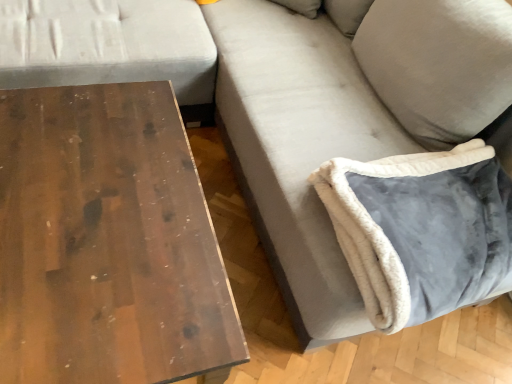
Where is `wooden table at left`? This screenshot has height=384, width=512. wooden table at left is located at coordinates (106, 242).

The height and width of the screenshot is (384, 512). Describe the element at coordinates (106, 242) in the screenshot. I see `wooden table at left` at that location.

Describe the element at coordinates (422, 230) in the screenshot. The height and width of the screenshot is (384, 512). I see `velvet gray pillow at lower right` at that location.

Identify the location of velvet gray pillow at lower right. (422, 230).

At what (x,y) coordinates should I click in order to perform the action: click on wooden table at left. Please return your answer as a coordinate pair (x, y). The image size is (512, 384). Looking at the image, I should click on (106, 242).

Considering the relative positions of wooden table at left and velvet gray pillow at lower right in the image provided, is wooden table at left to the left of velvet gray pillow at lower right from the viewer's perspective?

Yes, wooden table at left is to the left of velvet gray pillow at lower right.

Is the depth of wooden table at left greater than that of velvet gray pillow at lower right?

No, wooden table at left is closer to the camera.

Is point (81, 237) positioned after point (466, 251)?

No, (81, 237) is in front of (466, 251).

From the image's perspective, between wooden table at left and velvet gray pillow at lower right, who is located below?

wooden table at left is shown below in the image.

From a real-world perspective, is wooden table at left positioned under velvet gray pillow at lower right based on gravity?

Indeed, from a real-world perspective, wooden table at left is positioned beneath velvet gray pillow at lower right.

Does wooden table at left have a lesser width compared to velvet gray pillow at lower right?

No.

Who is shorter, wooden table at left or velvet gray pillow at lower right?

velvet gray pillow at lower right is shorter.

Can you confirm if wooden table at left is bigger than velvet gray pillow at lower right?

Correct, wooden table at left is larger in size than velvet gray pillow at lower right.

Does wooden table at left contain velvet gray pillow at lower right?

No, velvet gray pillow at lower right is not surrounded by wooden table at left.

Is wooden table at left far from velvet gray pillow at lower right?

That's not correct — wooden table at left is a little close to velvet gray pillow at lower right.

Is wooden table at left aimed at velvet gray pillow at lower right?

No, wooden table at left does not turn towards velvet gray pillow at lower right.

Where is `table beneath the velvet gray pillow at lower right (from a real-world perspective)`? The height and width of the screenshot is (384, 512). table beneath the velvet gray pillow at lower right (from a real-world perspective) is located at coordinates (106, 242).

Between velvet gray pillow at lower right and wooden table at left, which one appears on the left side from the viewer's perspective?

wooden table at left.

Which object is closer to the camera taking this photo, velvet gray pillow at lower right or wooden table at left?

Positioned in front is wooden table at left.

Considering the points (383, 242) and (34, 126), which point is behind, point (383, 242) or point (34, 126)?

The point (34, 126) is farther from the camera.

From the image's perspective, is velvet gray pillow at lower right located above or below wooden table at left?

velvet gray pillow at lower right is above wooden table at left.

From a real-world perspective, which is physically below, velvet gray pillow at lower right or wooden table at left?

From a 3D spatial view, wooden table at left is below.

Can you confirm if velvet gray pillow at lower right is thinner than wooden table at left?

Yes, velvet gray pillow at lower right is thinner than wooden table at left.

In terms of height, does velvet gray pillow at lower right look taller or shorter compared to wooden table at left?

Considering their sizes, velvet gray pillow at lower right has less height than wooden table at left.

From the picture: Considering the sizes of objects velvet gray pillow at lower right and wooden table at left in the image provided, who is bigger, velvet gray pillow at lower right or wooden table at left?

wooden table at left.

Choose the correct answer: Is velvet gray pillow at lower right inside wooden table at left or outside it?

velvet gray pillow at lower right cannot be found inside wooden table at left.

Would you say velvet gray pillow at lower right is a long distance from wooden table at left?

They are positioned close to each other.

Could you tell me if velvet gray pillow at lower right is turned towards wooden table at left?

No, velvet gray pillow at lower right is not turned towards wooden table at left.

Can you tell me how much velvet gray pillow at lower right and wooden table at left differ in facing direction?

They differ by 1.59 degrees in their facing directions.

Identify the location of pillow above the wooden table at left (from the image's perspective). (422, 230).

Identify the location of table that appears in front of the velvet gray pillow at lower right. This screenshot has height=384, width=512. (106, 242).

Locate an element on the screen. pillow on the right of the wooden table at left is located at coordinates (422, 230).